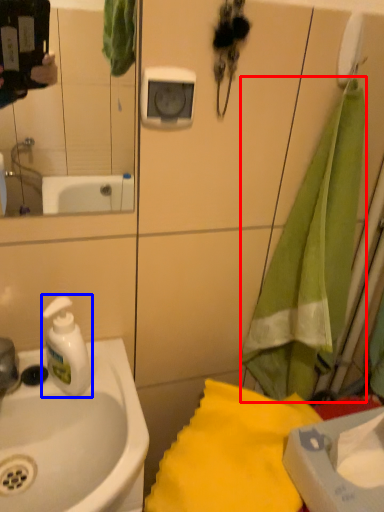
Question: Which point is closer to the camera, beach towel (highlighted by a red box) or soap dispenser (highlighted by a blue box)?

Choices:
 (A) beach towel
 (B) soap dispenser

Answer: (A)